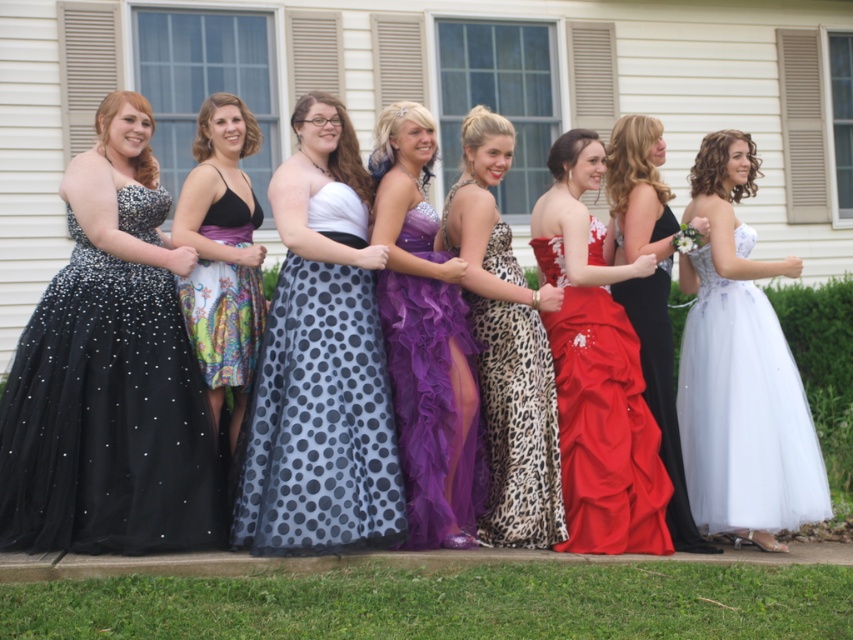
You are a photographer at a prom event. You need to position yourself so that you can capture both the black sequined dress at left and the multicolored floral dress at center in the same frame. Based on their positions, which direction should you face to ensure both are visible?

You should face towards the center where the multicolored floral dress is located, as the black sequined dress at left is positioned to the left of it, ensuring both will be in the frame when centered appropriately.

You are a photographer trying to capture a group photo of the polka dot tulle dress at center and the matte black dress at center. Which dress should you focus on first to ensure it fits well in the frame?

The polka dot tulle dress at center is larger in size than the matte black dress at center, so you should focus on positioning the polka dot tulle dress at center first to ensure it fits within the frame.